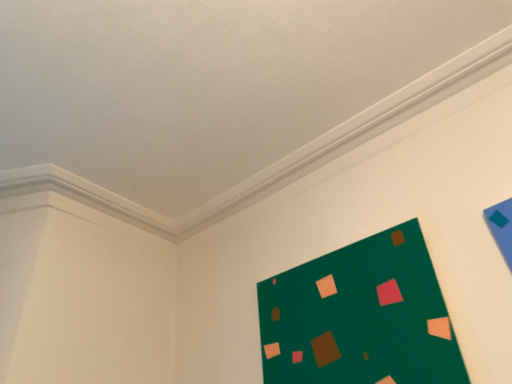
What is the approximate width of green matte bulletin board at lower right?

green matte bulletin board at lower right is 1.59 inches in width.

Image resolution: width=512 pixels, height=384 pixels. Describe the element at coordinates (360, 317) in the screenshot. I see `green matte bulletin board at lower right` at that location.

What are the coordinates of `green matte bulletin board at lower right` in the screenshot? It's located at (360, 317).

What is the approximate height of green matte bulletin board at lower right?

green matte bulletin board at lower right is 18.02 inches tall.

What are the coordinates of `green matte bulletin board at lower right` in the screenshot? It's located at 360,317.